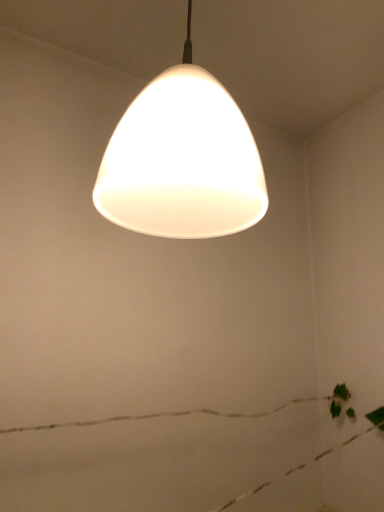
What do you see at coordinates (182, 160) in the screenshot?
I see `matte white cone at center` at bounding box center [182, 160].

What is the approximate width of matte white cone at center?

The width of matte white cone at center is 9.86 inches.

Where is `matte white cone at center`? The width and height of the screenshot is (384, 512). matte white cone at center is located at coordinates (182, 160).

In order to face matte white cone at center, should I rotate leftwards or rightwards?

You should look left and rotate roughly 0.841 degrees.

Identify the location of matte white cone at center. The width and height of the screenshot is (384, 512). (182, 160).